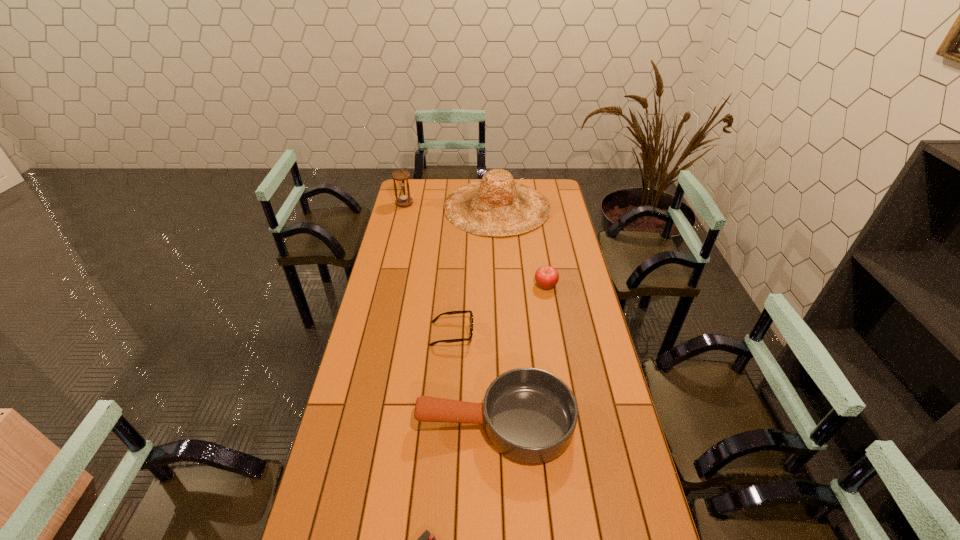
Locate an element on the screen. The image size is (960, 540). vacant space located on the handle side of the pan is located at coordinates (343, 422).

You are a GUI agent. You are given a task and a screenshot of the screen. Output one action in this format:
    pyautogui.click(x=<x>, y=<y>)
    Task: Click on the free location located on the back of the apple
    
    Given the screenshot: What is the action you would take?
    pyautogui.click(x=542, y=267)

This screenshot has height=540, width=960. In order to click on vacant space situated 0.160m on the lenses of the spectacles in this screenshot , I will do `click(516, 334)`.

Locate an element on the screen. Image resolution: width=960 pixels, height=540 pixels. sunhat present at the far edge is located at coordinates (497, 205).

Find the location of a particular element. hourglass that is at the far edge is located at coordinates (401, 176).

Where is `object situated at the left edge`? object situated at the left edge is located at coordinates (401, 176).

Identify the location of sunhat present at the right edge. The width and height of the screenshot is (960, 540). click(x=497, y=205).

I want to click on pan at the right edge, so click(529, 415).

At what (x,y) coordinates should I click in order to perform the action: click on apple that is at the right edge. Please return your answer as a coordinate pair (x, y). Looking at the image, I should click on (546, 277).

You are a GUI agent. You are given a task and a screenshot of the screen. Output one action in this format:
    pyautogui.click(x=<x>, y=<y>)
    Task: Click on the object at the far left corner
    The height and width of the screenshot is (540, 960).
    Given the screenshot: What is the action you would take?
    pyautogui.click(x=401, y=176)